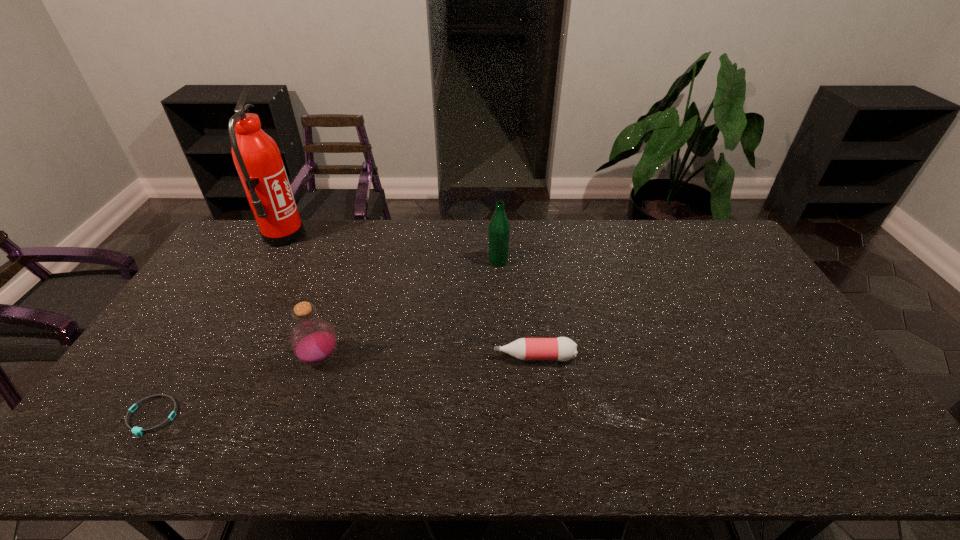
The image size is (960, 540). Identify the location of free point between the tallest object and the nearest object. (218, 326).

The width and height of the screenshot is (960, 540). I want to click on free space between the shortest object and the farthest object, so click(x=218, y=326).

Find the location of a particular element. vacant space in between the leftmost bottle and the fourth tallest object is located at coordinates 427,357.

The image size is (960, 540). Find the location of `vacant area that lies between the fire extinguisher and the wristband`. vacant area that lies between the fire extinguisher and the wristband is located at coordinates (218, 326).

The height and width of the screenshot is (540, 960). What are the coordinates of `free space between the tallest bottle and the shortest bottle` in the screenshot? It's located at (516, 309).

Select which object is the third closest to the tallest bottle. Please provide its 2D coordinates. Your answer should be formatted as a tuple, i.e. [(x, y)], where the tuple contains the x and y coordinates of a point satisfying the conditions above.

[(257, 158)]

The height and width of the screenshot is (540, 960). I want to click on the fourth closest object to the shortest bottle, so click(x=257, y=158).

Image resolution: width=960 pixels, height=540 pixels. What are the coordinates of `bottle that is the closest to the tallest bottle` in the screenshot? It's located at (562, 348).

Identify the location of bottle that is the second closest to the tallest bottle. (313, 339).

This screenshot has width=960, height=540. In order to click on vacant space that satisfies the following two spatial constraints: 1. with the cap open on the shortest bottle; 2. on the front side of the third shortest object in this screenshot , I will do `click(535, 359)`.